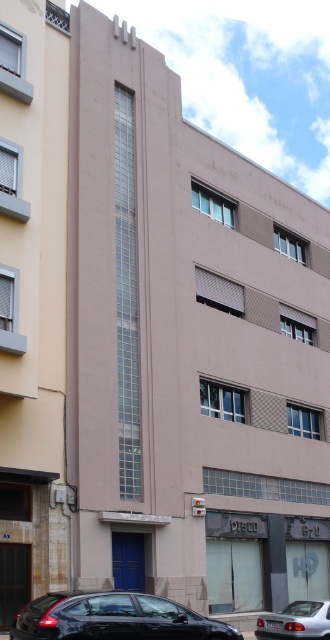
Which is more to the left, shiny black sedan at lower left or silver metallic car at lower center?

From the viewer's perspective, shiny black sedan at lower left appears more on the left side.

Does shiny black sedan at lower left come in front of silver metallic car at lower center?

Yes, it is.

Find the location of a particular element. The width and height of the screenshot is (330, 640). shiny black sedan at lower left is located at coordinates (x=52, y=618).

This screenshot has height=640, width=330. What are the coordinates of `shiny black sedan at lower left` in the screenshot? It's located at (52, 618).

Is shiny black sedan at center thinner than silver metallic car at lower center?

No.

Who is lower down, shiny black sedan at center or silver metallic car at lower center?

silver metallic car at lower center is lower down.

Describe the element at coordinates (113, 618) in the screenshot. I see `shiny black sedan at center` at that location.

Locate an element on the screen. The image size is (330, 640). shiny black sedan at center is located at coordinates (113, 618).

Is shiny black sedan at center closer to camera compared to shiny black sedan at lower left?

No, shiny black sedan at center is behind shiny black sedan at lower left.

Does shiny black sedan at center appear on the left side of shiny black sedan at lower left?

In fact, shiny black sedan at center is to the right of shiny black sedan at lower left.

Which is in front, point (121, 612) or point (63, 618)?

Positioned in front is point (63, 618).

You are a GUI agent. You are given a task and a screenshot of the screen. Output one action in this format:
    pyautogui.click(x=<x>, y=<y>)
    Task: Click on the shiny black sedan at center
    The width and height of the screenshot is (330, 640).
    Given the screenshot: What is the action you would take?
    pyautogui.click(x=113, y=618)